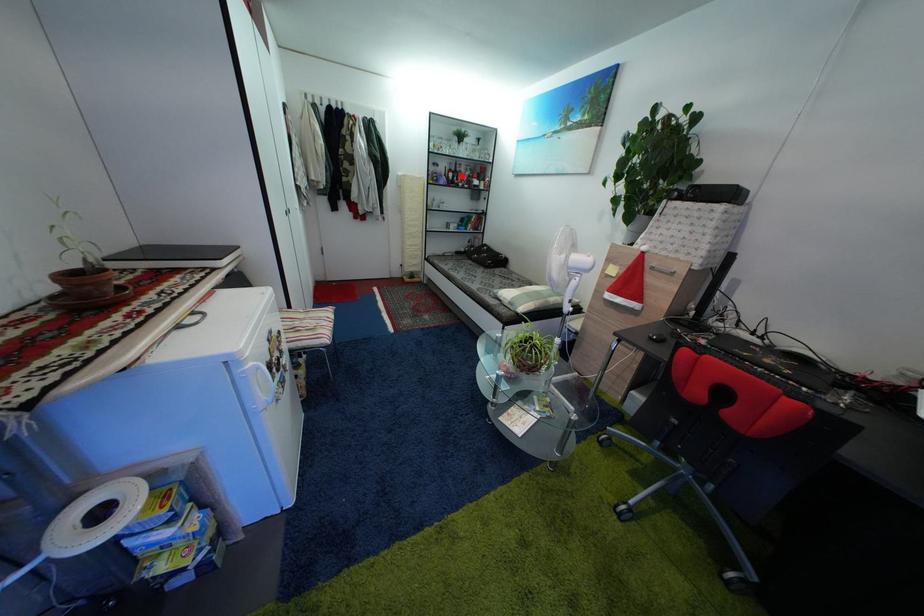
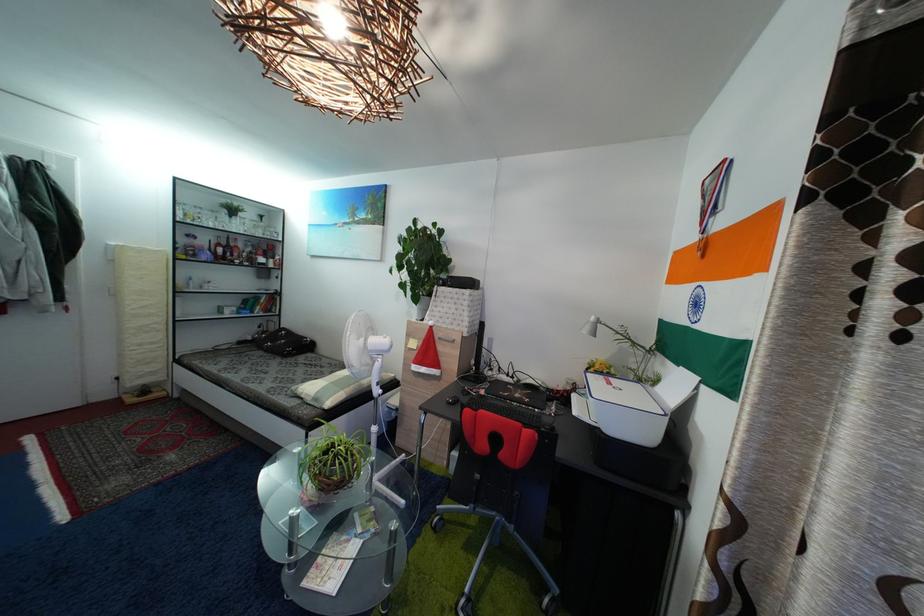
In the second image, find the point that corresponds to the highlighted location in the first image.

(233, 251)